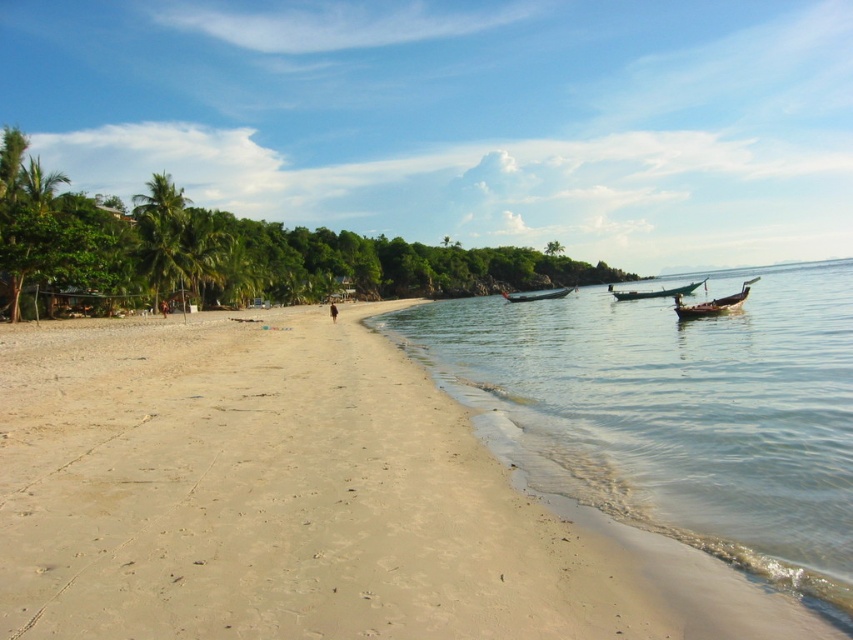
You are standing on the beach and want to walk to the wooden boat at center. Is the green wooden boat at right blocking your path?

The green wooden boat at right is in front of the wooden boat at center, so it is blocking the path to the wooden boat at center.

You are standing on the beach and want to reach the clear water at lower right without getting your feet wet. There is a green leafy palm tree at left blocking your path. Can you walk around the palm tree to reach the water?

The clear water at lower right is closer to the viewer than the green leafy palm tree at left, so you can walk around the palm tree to reach the water since it is behind the tree.

You are standing at the center of the beach and want to find the clear water. Which direction should you walk to reach the clear water at lower right?

You should walk towards the lower right direction to reach the clear water at lower right.